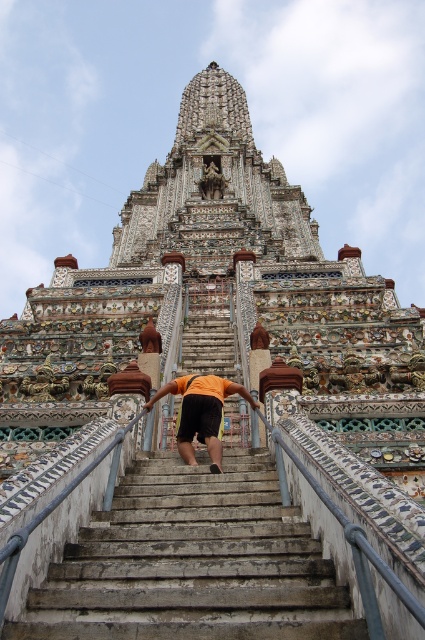
You are a tour guide leading a group to the temple entrance. You notice the white stone stairs at center and the orange fabric at center. If your group needs to place a 2.5 meter long barrier between them for safety, will there be enough space?

The white stone stairs at center and orange fabric at center are 7.93 meters apart. Since the barrier is only 2.5 meters long, there is sufficient space between them to place the barrier safely.

You are standing at the base of the staircase leading to Wat Arun temple. You want to take a photo of the white stone stairs at center from directly above. Is the location at point A, which is at coordinates 0.880, 0.452, the correct spot to aim your camera?

Yes, the white stone stairs at center are located at point (x=192, y=563), so aiming the camera at that coordinate will capture them from directly above.

You are standing at the base of the staircase leading to Wat Arun temple. You notice two points marked on the structure. The first point is at coordinate point (153,612) and the second is at point (209,394). Which point is closer to you?

Point (153,612) is closer to the viewer than point (209,394).